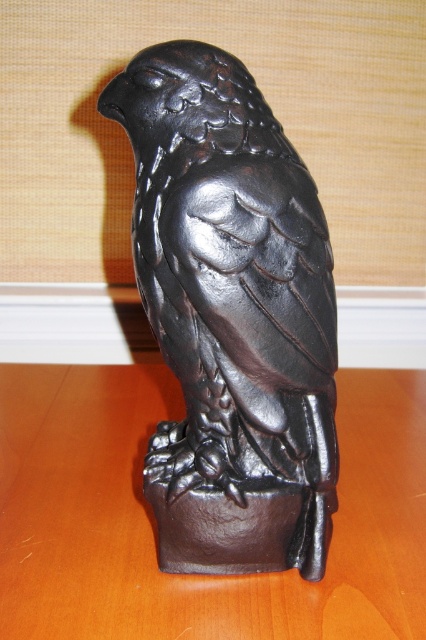
Question: Among these objects, which one is farthest from the camera?

Choices:
 (A) brown matte table at center
 (B) matte black bird at center

Answer: (A)

Question: Is matte black bird at center above brown matte table at center?

Choices:
 (A) no
 (B) yes

Answer: (B)

Question: Observing the image, what is the correct spatial positioning of matte black bird at center in reference to brown matte table at center?

Choices:
 (A) right
 (B) left

Answer: (B)

Question: Among these objects, which one is nearest to the camera?

Choices:
 (A) brown matte table at center
 (B) matte black bird at center

Answer: (B)

Question: Can you confirm if matte black bird at center is thinner than brown matte table at center?

Choices:
 (A) yes
 (B) no

Answer: (A)